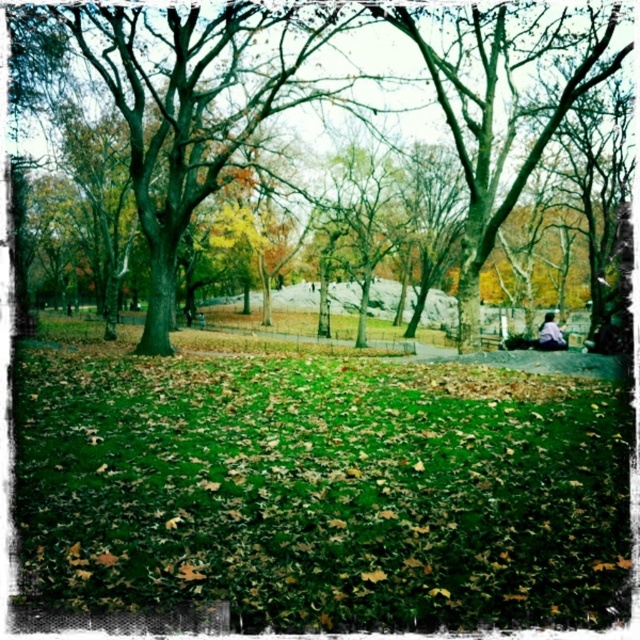
Who is more distant from viewer, (525, 452) or (220, 129)?

Positioned behind is point (220, 129).

Which is below, green grassy field at center or green leafy tree at center?

green grassy field at center is lower down.

Where is `green grassy field at center`? green grassy field at center is located at coordinates (324, 490).